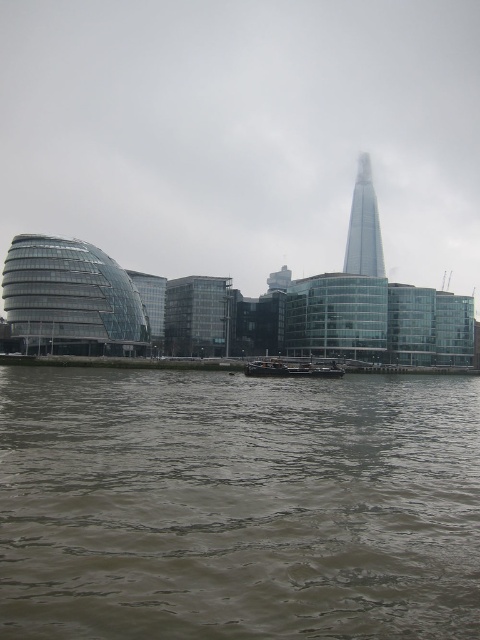
Measure the distance between glassy skyscraper at upper right and dark gray metallic barge at center.

109.74 meters

Is glassy skyscraper at upper right wider than dark gray metallic barge at center?

In fact, glassy skyscraper at upper right might be narrower than dark gray metallic barge at center.

Where is `glassy skyscraper at upper right`? glassy skyscraper at upper right is located at coordinates (363, 227).

Which of these two, brown murky water at lower center or transparent glass buildings at center, stands shorter?

Standing shorter between the two is brown murky water at lower center.

Between brown murky water at lower center and transparent glass buildings at center, which one is positioned lower?

Positioned lower is brown murky water at lower center.

Describe the element at coordinates (238, 506) in the screenshot. I see `brown murky water at lower center` at that location.

Identify the location of brown murky water at lower center. Image resolution: width=480 pixels, height=640 pixels. (238, 506).

Is brown murky water at lower center taller than glassy skyscraper at upper right?

In fact, brown murky water at lower center may be shorter than glassy skyscraper at upper right.

Does brown murky water at lower center have a lesser width compared to glassy skyscraper at upper right?

In fact, brown murky water at lower center might be wider than glassy skyscraper at upper right.

Image resolution: width=480 pixels, height=640 pixels. In order to click on brown murky water at lower center in this screenshot , I will do `click(238, 506)`.

Locate an element on the screen. brown murky water at lower center is located at coordinates (238, 506).